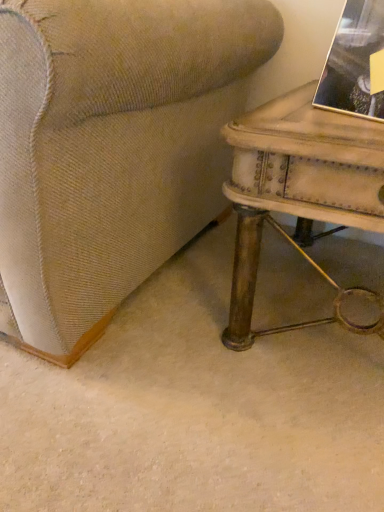
This screenshot has width=384, height=512. Describe the element at coordinates (298, 188) in the screenshot. I see `rustic wood table at right` at that location.

This screenshot has height=512, width=384. In order to click on rustic wood table at right in this screenshot , I will do `click(298, 188)`.

In order to click on gold-framed photo at upper right in this screenshot , I will do tap(353, 62).

The image size is (384, 512). Describe the element at coordinates (353, 62) in the screenshot. I see `gold-framed photo at upper right` at that location.

The height and width of the screenshot is (512, 384). Identify the location of rustic wood table at right. (298, 188).

Between gold-framed photo at upper right and rustic wood table at right, which one appears on the right side from the viewer's perspective?

From the viewer's perspective, gold-framed photo at upper right appears more on the right side.

Who is more distant, gold-framed photo at upper right or rustic wood table at right?

Positioned behind is gold-framed photo at upper right.

Which is less distant, (x=316, y=91) or (x=243, y=326)?

The point (x=316, y=91) is closer to the camera.

From the image's perspective, relative to rustic wood table at right, is gold-framed photo at upper right above or below?

From the image's perspective, gold-framed photo at upper right appears above rustic wood table at right.

From a real-world perspective, who is located lower, gold-framed photo at upper right or rustic wood table at right?

rustic wood table at right, from a real-world perspective.

Is gold-framed photo at upper right wider or thinner than rustic wood table at right?

Considering their sizes, gold-framed photo at upper right looks slimmer than rustic wood table at right.

Considering the sizes of objects gold-framed photo at upper right and rustic wood table at right in the image provided, who is taller, gold-framed photo at upper right or rustic wood table at right?

With more height is rustic wood table at right.

Between gold-framed photo at upper right and rustic wood table at right, which one has smaller size?

With smaller size is gold-framed photo at upper right.

Would you say gold-framed photo at upper right is outside rustic wood table at right?

Yes, gold-framed photo at upper right is outside of rustic wood table at right.

Are gold-framed photo at upper right and rustic wood table at right beside each other?

gold-framed photo at upper right and rustic wood table at right are not in contact.

Based on the photo, is gold-framed photo at upper right oriented towards rustic wood table at right?

No, gold-framed photo at upper right is not facing towards rustic wood table at right.

Measure the distance from gold-framed photo at upper right to rustic wood table at right.

They are 7.89 inches apart.

Find the location of a particular element. The image size is (384, 512). book on the right of rustic wood table at right is located at coordinates (353, 62).

Is rustic wood table at right to the left of gold-framed photo at upper right from the viewer's perspective?

Yes.

From the picture: Which is in front, rustic wood table at right or gold-framed photo at upper right?

rustic wood table at right is closer to the camera.

Which is closer, (229, 342) or (379, 50)?

Point (229, 342) is positioned farther from the camera compared to point (379, 50).

From the image's perspective, between rustic wood table at right and gold-framed photo at upper right, who is located below?

rustic wood table at right, from the image's perspective.

From a real-world perspective, which object rests below the other?

In real-world perspective, rustic wood table at right is lower.

Does rustic wood table at right have a lesser width compared to gold-framed photo at upper right?

In fact, rustic wood table at right might be wider than gold-framed photo at upper right.

Considering the sizes of rustic wood table at right and gold-framed photo at upper right in the image, is rustic wood table at right taller or shorter than gold-framed photo at upper right?

Clearly, rustic wood table at right is taller compared to gold-framed photo at upper right.

Considering the relative sizes of rustic wood table at right and gold-framed photo at upper right in the image provided, is rustic wood table at right bigger than gold-framed photo at upper right?

Yes.

Is rustic wood table at right spatially inside gold-framed photo at upper right, or outside of it?

rustic wood table at right is spatially situated outside gold-framed photo at upper right.

Are rustic wood table at right and gold-framed photo at upper right far apart?

No, rustic wood table at right is not far away from gold-framed photo at upper right.

Could you tell me if rustic wood table at right is facing gold-framed photo at upper right?

No, rustic wood table at right is not oriented towards gold-framed photo at upper right.

How distant is rustic wood table at right from gold-framed photo at upper right?

7.89 inches.

You are a GUI agent. You are given a task and a screenshot of the screen. Output one action in this format:
    pyautogui.click(x=<x>, y=<y>)
    Task: Click on the table below the gold-framed photo at upper right (from a real-world perspective)
    Image resolution: width=384 pixels, height=512 pixels.
    Given the screenshot: What is the action you would take?
    pyautogui.click(x=298, y=188)

I want to click on book on the right side of rustic wood table at right, so click(353, 62).

Where is `table to the left of gold-framed photo at upper right`? The height and width of the screenshot is (512, 384). table to the left of gold-framed photo at upper right is located at coordinates (298, 188).